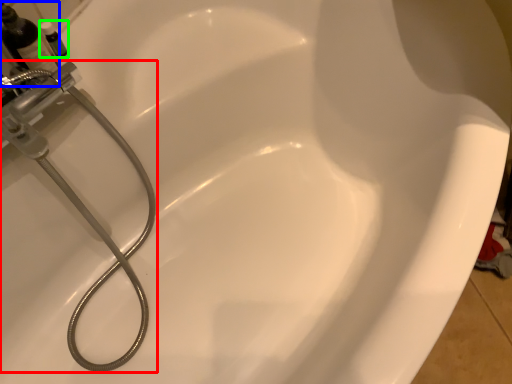
Question: Which is farther away from plumbing fixture (highlighted by a red box)? bottle (highlighted by a blue box) or toiletry (highlighted by a green box)?

Choices:
 (A) bottle
 (B) toiletry

Answer: (B)